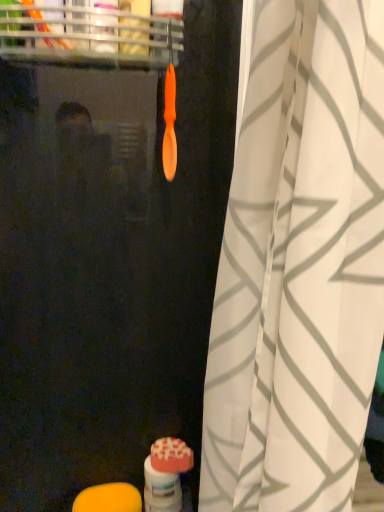
The image size is (384, 512). Describe the element at coordinates (171, 456) in the screenshot. I see `matte pink soap at lower center, which is counted as the 1th soap, starting from the top` at that location.

Describe the element at coordinates (166, 475) in the screenshot. The height and width of the screenshot is (512, 384). I see `matte orange toothbrush at lower center` at that location.

What is the approximate width of orange matte soap at lower left, which is the 2th soap in right-to-left order?

It is 10.49 centimeters.

This screenshot has height=512, width=384. I want to click on white textured curtain at center, so coord(299,265).

From their relative heights in the image, would you say matte pink soap at lower center, acting as the second soap starting from the left, is taller or shorter than orange matte soap at lower left, which is the 2th soap in right-to-left order?

Considering their sizes, matte pink soap at lower center, acting as the second soap starting from the left, has less height than orange matte soap at lower left, which is the 2th soap in right-to-left order.

This screenshot has height=512, width=384. In order to click on soap that appears on the left of matte pink soap at lower center, the second soap in the bottom-to-top sequence in this screenshot , I will do `click(109, 498)`.

From the image's perspective, who appears lower, matte pink soap at lower center, which is counted as the 1th soap, starting from the top, or orange matte soap at lower left, which is the second soap from top to bottom?

orange matte soap at lower left, which is the second soap from top to bottom, is shown below in the image.

How many degrees apart are the facing directions of matte pink soap at lower center, the second soap in the bottom-to-top sequence, and orange matte soap at lower left, which is the second soap from top to bottom?

There is a 0.000877-degree angle between the facing directions of matte pink soap at lower center, the second soap in the bottom-to-top sequence, and orange matte soap at lower left, which is the second soap from top to bottom.

Which object is positioned more to the left, white textured curtain at center or orange matte soap at lower left, which is the 1th soap from bottom to top?

From the viewer's perspective, orange matte soap at lower left, which is the 1th soap from bottom to top, appears more on the left side.

Which of these two, white textured curtain at center or orange matte soap at lower left, positioned as the first soap in left-to-right order, is thinner?

With smaller width is orange matte soap at lower left, positioned as the first soap in left-to-right order.

Is white textured curtain at center aimed at orange matte soap at lower left, which is the second soap from top to bottom?

No.

Is point (373, 11) farther from viewer compared to point (108, 503)?

No, (373, 11) is in front of (108, 503).

Between white textured curtain at center and matte pink soap at lower center, the second soap in the bottom-to-top sequence, which one has larger width?

white textured curtain at center.

Is the position of white textured curtain at center less distant than that of matte pink soap at lower center, which is counted as the 1th soap, starting from the top?

Yes, it is in front of matte pink soap at lower center, which is counted as the 1th soap, starting from the top.

From a real-world perspective, is white textured curtain at center above or below matte pink soap at lower center, acting as the second soap starting from the left?

Clearly, from a real-world perspective, white textured curtain at center is above matte pink soap at lower center, acting as the second soap starting from the left.

Is point (270, 58) closer to camera compared to point (175, 448)?

That is True.

Which object is closer to the camera, matte pink soap at lower center, the second soap in the bottom-to-top sequence, or matte orange toothbrush at lower center?

matte pink soap at lower center, the second soap in the bottom-to-top sequence, is more forward.

Which soap is the 1st one when counting from the front of the matte orange toothbrush at lower center? Please provide its 2D coordinates.

[(171, 456)]

Would you say matte pink soap at lower center, acting as the second soap starting from the left, is inside or outside matte orange toothbrush at lower center?

matte pink soap at lower center, acting as the second soap starting from the left, cannot be found inside matte orange toothbrush at lower center.

Is matte pink soap at lower center, the second soap in the bottom-to-top sequence, positioned with its back to matte orange toothbrush at lower center?

matte pink soap at lower center, the second soap in the bottom-to-top sequence, does not have its back to matte orange toothbrush at lower center.

Is matte orange toothbrush at lower center outside of white textured curtain at center?

matte orange toothbrush at lower center is positioned outside white textured curtain at center.

Is matte orange toothbrush at lower center positioned with its back to white textured curtain at center?

That's not correct — matte orange toothbrush at lower center is not looking away from white textured curtain at center.

Which of these two, matte orange toothbrush at lower center or white textured curtain at center, is wider?

With larger width is white textured curtain at center.

Between matte orange toothbrush at lower center and white textured curtain at center, which one appears on the right side from the viewer's perspective?

white textured curtain at center.

Based on their positions, is matte orange toothbrush at lower center located to the left or right of matte pink soap at lower center, the 1th soap viewed from the right?

matte orange toothbrush at lower center is to the left of matte pink soap at lower center, the 1th soap viewed from the right.

From the image's perspective, relative to matte pink soap at lower center, which is counted as the 1th soap, starting from the top, is matte orange toothbrush at lower center above or below?

From the image's perspective, matte orange toothbrush at lower center appears below matte pink soap at lower center, which is counted as the 1th soap, starting from the top.

Is matte orange toothbrush at lower center far from matte pink soap at lower center, the second soap in the bottom-to-top sequence?

No, matte orange toothbrush at lower center is not far away from matte pink soap at lower center, the second soap in the bottom-to-top sequence.

Where is `soap located on the right of matte orange toothbrush at lower center`? soap located on the right of matte orange toothbrush at lower center is located at coordinates (171, 456).

How different are the orientations of white textured curtain at center and matte orange toothbrush at lower center in degrees?

The facing directions of white textured curtain at center and matte orange toothbrush at lower center are 75.4 degrees apart.

Are white textured curtain at center and matte orange toothbrush at lower center located far from each other?

They are positioned close to each other.

Considering the relative sizes of white textured curtain at center and matte orange toothbrush at lower center in the image provided, is white textured curtain at center shorter than matte orange toothbrush at lower center?

Incorrect, the height of white textured curtain at center does not fall short of that of matte orange toothbrush at lower center.

Considering the sizes of white textured curtain at center and matte orange toothbrush at lower center in the image, is white textured curtain at center wider or thinner than matte orange toothbrush at lower center?

Clearly, white textured curtain at center has more width compared to matte orange toothbrush at lower center.

In the image, there is a matte pink soap at lower center, the second soap in the bottom-to-top sequence. Identify the location of soap below it (from the image's perspective). This screenshot has height=512, width=384. (109, 498).

Where is `curtain that is in front of the orange matte soap at lower left, which is the second soap from top to bottom`? This screenshot has height=512, width=384. curtain that is in front of the orange matte soap at lower left, which is the second soap from top to bottom is located at coordinates (299, 265).

Considering their positions, is white textured curtain at center positioned further to matte pink soap at lower center, which is counted as the 1th soap, starting from the top, than orange matte soap at lower left, which is the second soap from top to bottom?

white textured curtain at center is further to matte pink soap at lower center, which is counted as the 1th soap, starting from the top.

From the image, which object appears to be farther from matte pink soap at lower center, the second soap in the bottom-to-top sequence, orange matte soap at lower left, which is the second soap from top to bottom, or white textured curtain at center?

white textured curtain at center is further to matte pink soap at lower center, the second soap in the bottom-to-top sequence.

In the scene shown: Estimate the real-world distances between objects in this image. Which object is further from matte pink soap at lower center, the 1th soap viewed from the right, white textured curtain at center or matte orange toothbrush at lower center?

Among the two, white textured curtain at center is located further to matte pink soap at lower center, the 1th soap viewed from the right.

Based on the photo, which object lies further to the anchor point orange matte soap at lower left, positioned as the first soap in left-to-right order, white textured curtain at center or matte orange toothbrush at lower center?

white textured curtain at center lies further to orange matte soap at lower left, positioned as the first soap in left-to-right order, than the other object.

Based on their spatial positions, is matte orange toothbrush at lower center or orange matte soap at lower left, which is the 1th soap from bottom to top, further from white textured curtain at center?

Among the two, orange matte soap at lower left, which is the 1th soap from bottom to top, is located further to white textured curtain at center.

When comparing their distances from orange matte soap at lower left, which is the second soap from top to bottom, does matte orange toothbrush at lower center or matte pink soap at lower center, acting as the second soap starting from the left, seem further?

matte pink soap at lower center, acting as the second soap starting from the left, is further to orange matte soap at lower left, which is the second soap from top to bottom.

Considering their positions, is matte orange toothbrush at lower center positioned further to matte pink soap at lower center, acting as the second soap starting from the left, than white textured curtain at center?

The object further to matte pink soap at lower center, acting as the second soap starting from the left, is white textured curtain at center.

Looking at the image, which one is located further to white textured curtain at center, orange matte soap at lower left, which is the 1th soap from bottom to top, or matte pink soap at lower center, the 1th soap viewed from the right?

orange matte soap at lower left, which is the 1th soap from bottom to top, is further to white textured curtain at center.

You are a GUI agent. You are given a task and a screenshot of the screen. Output one action in this format:
    pyautogui.click(x=<x>, y=<y>)
    Task: Click on the soap between white textured curtain at center and matte pink soap at lower center, acting as the second soap starting from the left, from front to back
    The width and height of the screenshot is (384, 512).
    Given the screenshot: What is the action you would take?
    pyautogui.click(x=109, y=498)

Locate an element on the screen. toiletry between orange matte soap at lower left, which is the 2th soap in right-to-left order, and matte pink soap at lower center, the 1th soap viewed from the right, from left to right is located at coordinates (166, 475).